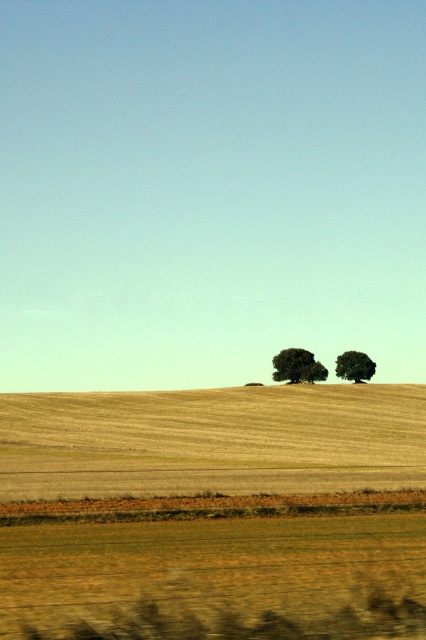
Question: Is golden textured wheat field at lower center closer to camera compared to green leafy tree at center?

Choices:
 (A) yes
 (B) no

Answer: (A)

Question: Is golden dry grass at center thinner than green leafy tree at center?

Choices:
 (A) yes
 (B) no

Answer: (B)

Question: Which of the following is the closest to the observer?

Choices:
 (A) (199, 420)
 (B) (354, 358)
 (C) (6, 468)
 (D) (290, 364)

Answer: (C)

Question: Based on their relative distances, which object is nearer to the golden textured wheat field at lower center?

Choices:
 (A) green leafy tree at center
 (B) golden dry grass at center
 (C) green matte tree at center

Answer: (B)

Question: Does green matte tree at center have a lesser width compared to green leafy tree at center?

Choices:
 (A) yes
 (B) no

Answer: (A)

Question: Which object is farther from the camera taking this photo?

Choices:
 (A) golden textured wheat field at lower center
 (B) green matte tree at center

Answer: (B)